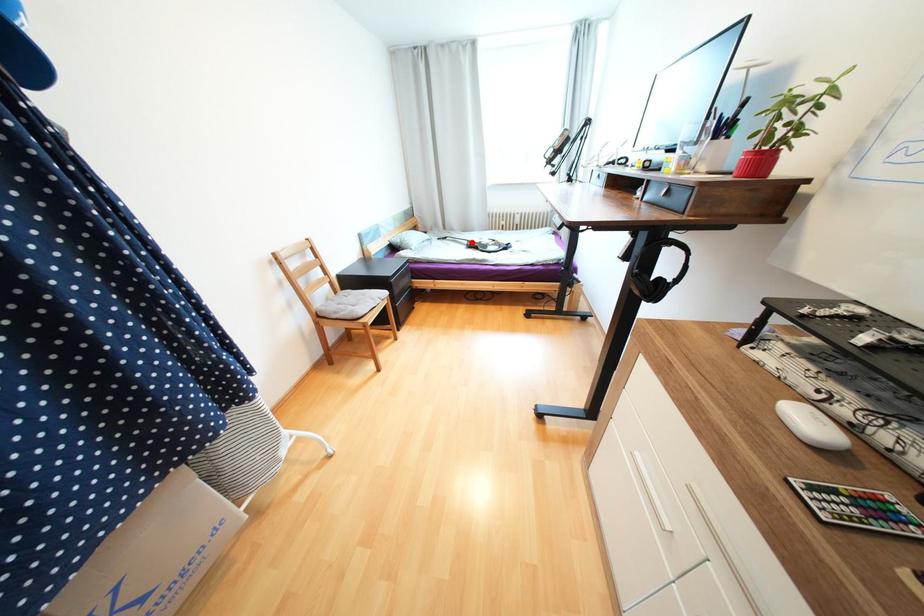
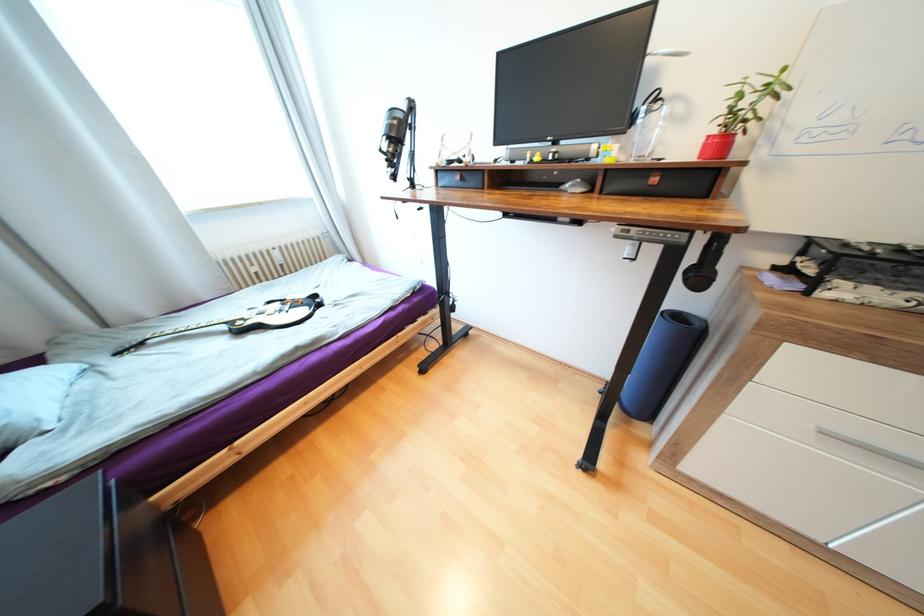
In the second image, find the point that corresponds to the highlighted location in the first image.

(229, 328)